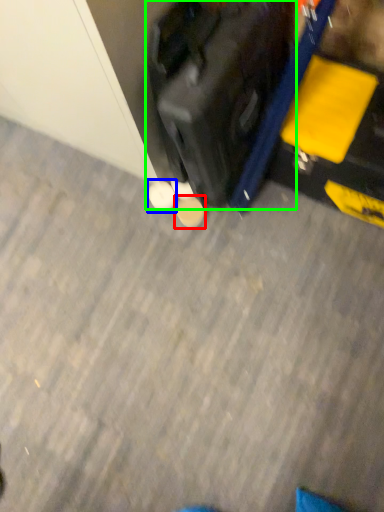
Question: Considering the real-world distances, which object is farthest from footwear (highlighted by a red box)? footwear (highlighted by a blue box) or suitcase (highlighted by a green box)?

Choices:
 (A) footwear
 (B) suitcase

Answer: (B)